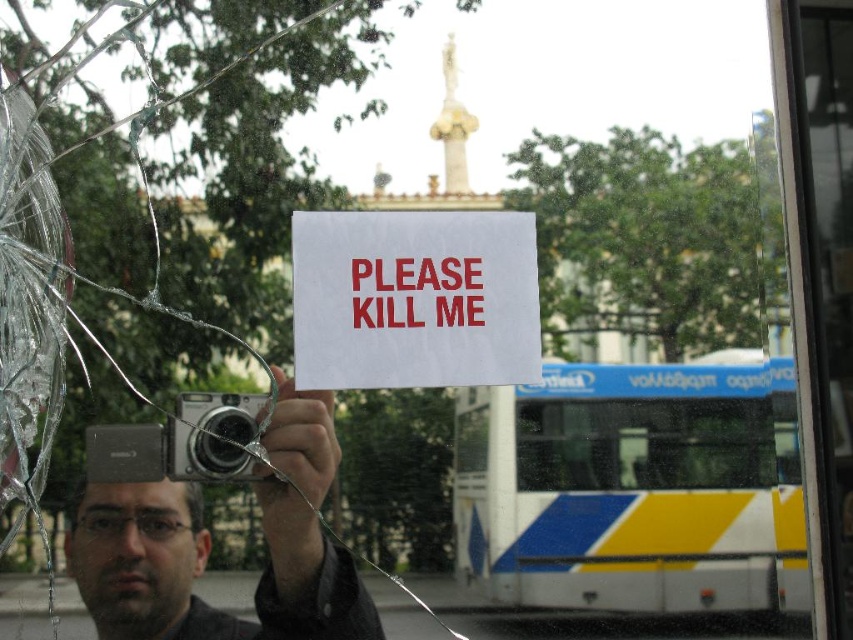
Consider the image. Can you confirm if white plastic bus at lower right is positioned to the left of matte silver camera at center?

In fact, white plastic bus at lower right is to the right of matte silver camera at center.

Does white plastic bus at lower right have a greater width compared to matte silver camera at center?

Indeed, white plastic bus at lower right has a greater width compared to matte silver camera at center.

Identify the location of white plastic bus at lower right. pyautogui.click(x=633, y=488).

Is point (459, 257) less distant than point (97, 508)?

No, (459, 257) is behind (97, 508).

Find the location of a particular element. The width and height of the screenshot is (853, 640). white paper sign at center is located at coordinates (415, 300).

Does white plastic bus at lower right have a greater width compared to white paper sign at center?

Indeed, white plastic bus at lower right has a greater width compared to white paper sign at center.

How distant is white plastic bus at lower right from white paper sign at center?

white plastic bus at lower right is 5.67 inches from white paper sign at center.

Between point (670, 582) and point (410, 232), which one is positioned in front?

Point (670, 582)

Locate an element on the screen. Image resolution: width=853 pixels, height=640 pixels. white plastic bus at lower right is located at coordinates (633, 488).